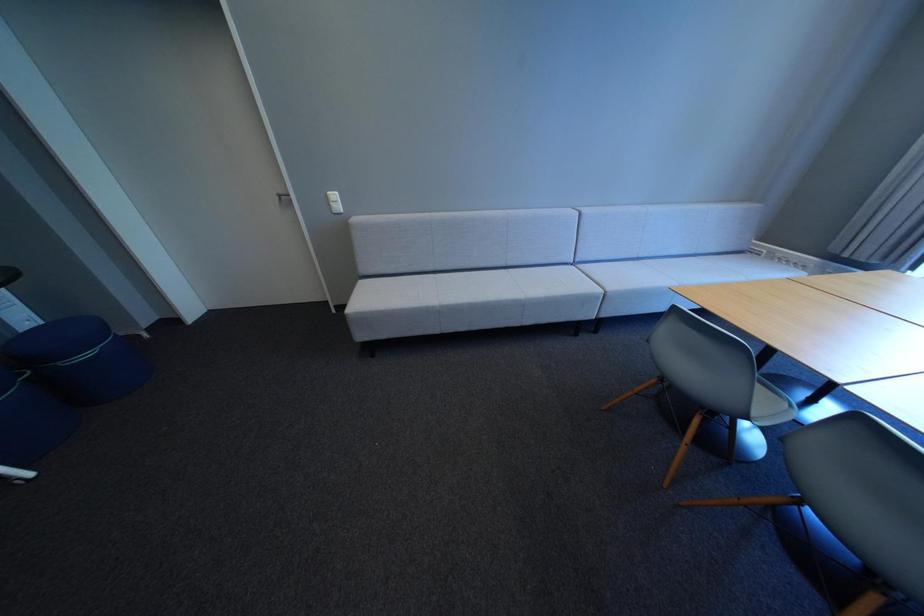
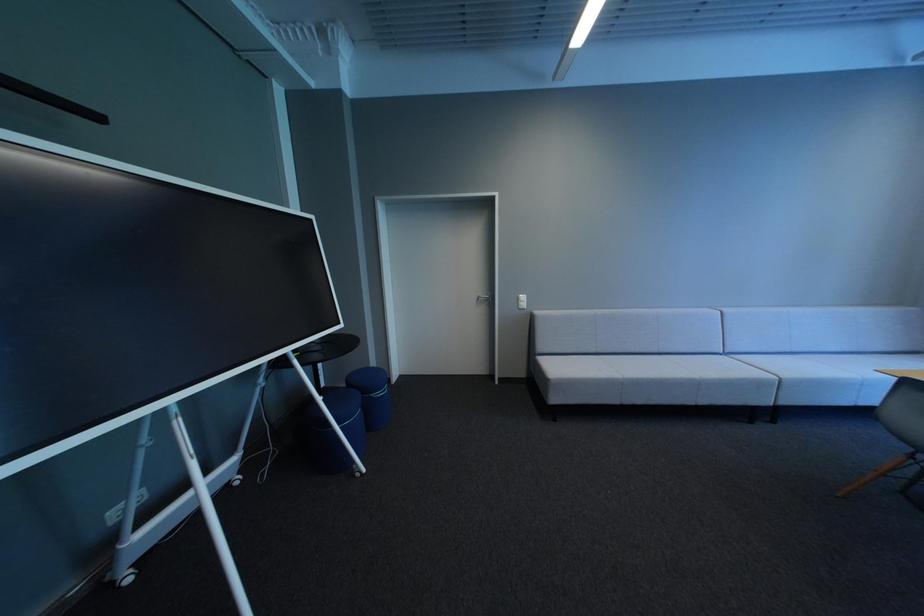
The images are taken continuously from a first-person perspective. In which direction are you moving?

The cameraman walked toward left, backward.